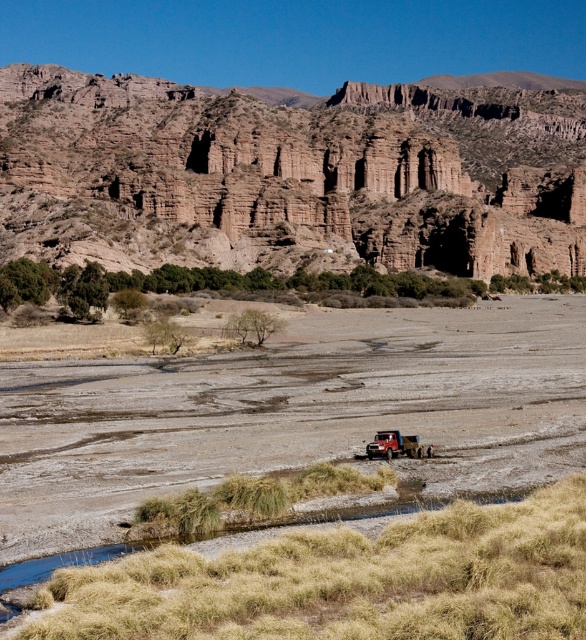
Consider the image. Can you confirm if brown rock formation at upper center is wider than brown sandy dirt field at center?

Yes, brown rock formation at upper center is wider than brown sandy dirt field at center.

Which is in front, point (226, 157) or point (277, 337)?

Point (277, 337) is in front.

Where is `brown rock formation at upper center`? This screenshot has width=586, height=640. brown rock formation at upper center is located at coordinates (289, 176).

Does brown rock formation at upper center appear over brushed metal truck at center?

Yes, brown rock formation at upper center is above brushed metal truck at center.

In the scene shown: Is brown rock formation at upper center to the right of brushed metal truck at center from the viewer's perspective?

Indeed, brown rock formation at upper center is positioned on the right side of brushed metal truck at center.

Describe the element at coordinates (289, 176) in the screenshot. This screenshot has width=586, height=640. I see `brown rock formation at upper center` at that location.

Locate an element on the screen. brown rock formation at upper center is located at coordinates (289, 176).

Does point (578, 324) come closer to viewer compared to point (386, 445)?

No.

Can you confirm if brown sandy dirt field at center is wider than brushed metal truck at center?

Correct, the width of brown sandy dirt field at center exceeds that of brushed metal truck at center.

Identify the location of brown sandy dirt field at center. (294, 412).